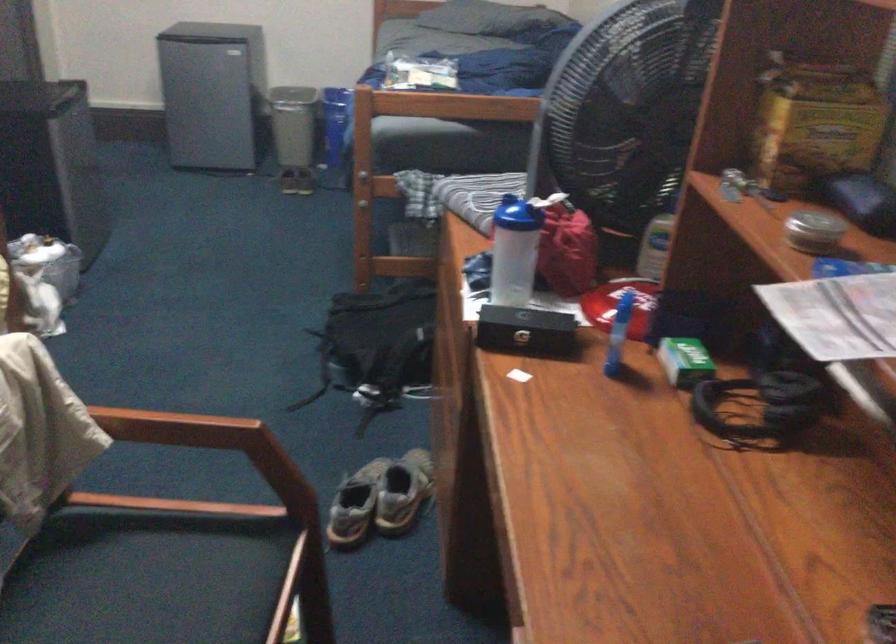
Describe the element at coordinates (767, 397) in the screenshot. The image size is (896, 644). I see `the black headphones` at that location.